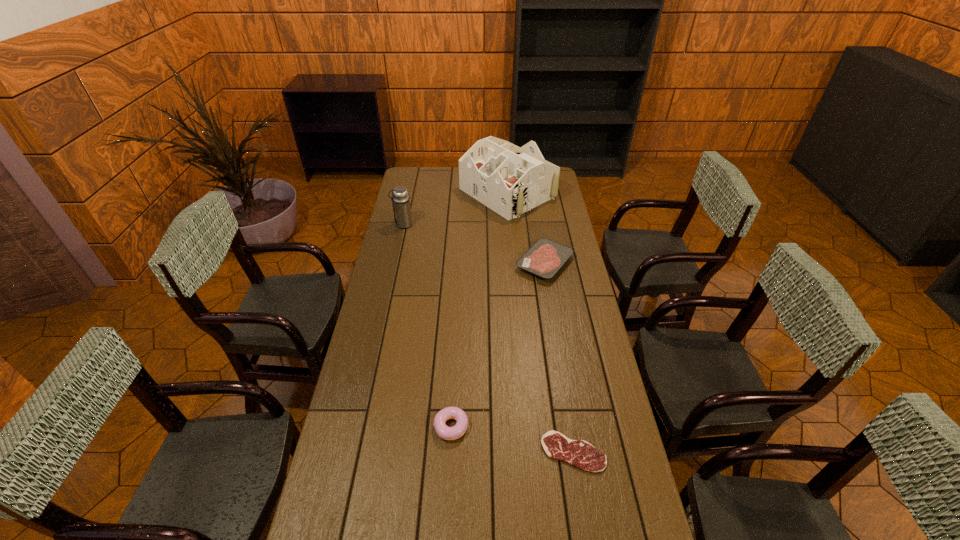
Where is `dollhouse`? The width and height of the screenshot is (960, 540). dollhouse is located at coordinates (510, 180).

Image resolution: width=960 pixels, height=540 pixels. I want to click on the second tallest object, so click(401, 202).

The image size is (960, 540). In order to click on the leftmost object in this screenshot , I will do `click(401, 202)`.

Identify the location of doughnut. Image resolution: width=960 pixels, height=540 pixels. (447, 433).

What are the coordinates of `the third farthest object` in the screenshot? It's located at (545, 257).

This screenshot has height=540, width=960. Find the location of `the taller steak`. the taller steak is located at coordinates (545, 257).

Identify the location of the nearer steak. The width and height of the screenshot is (960, 540). (579, 453).

The image size is (960, 540). In order to click on the shortest object in this screenshot , I will do `click(579, 453)`.

Find the location of a particular element. vacant space situated 0.310m on the left of the dollhouse is located at coordinates (399, 193).

Find the location of `vacant space located on the back of the third shortest object`. vacant space located on the back of the third shortest object is located at coordinates (456, 336).